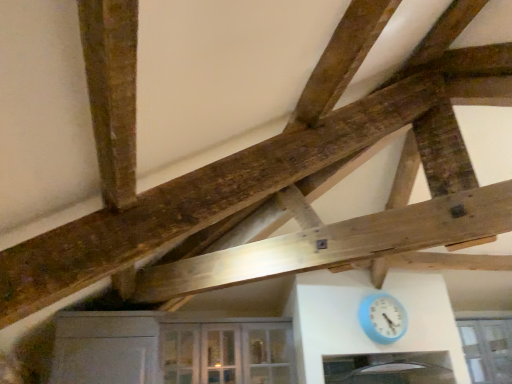
Question: Does clear glass window at lower right have a smaller size compared to clear glass cabinet at lower center?

Choices:
 (A) yes
 (B) no

Answer: (A)

Question: Is clear glass window at lower right aimed at clear glass cabinet at lower center?

Choices:
 (A) no
 (B) yes

Answer: (A)

Question: Is clear glass window at lower right at the left side of clear glass cabinet at lower center?

Choices:
 (A) yes
 (B) no

Answer: (B)

Question: Does clear glass window at lower right have a lesser width compared to clear glass cabinet at lower center?

Choices:
 (A) no
 (B) yes

Answer: (B)

Question: From the image's perspective, is clear glass window at lower right below clear glass cabinet at lower center?

Choices:
 (A) no
 (B) yes

Answer: (B)

Question: Considering the positions of blue plastic clock at lower right and clear glass window at lower right in the image, is blue plastic clock at lower right bigger or smaller than clear glass window at lower right?

Choices:
 (A) big
 (B) small

Answer: (B)

Question: Is blue plastic clock at lower right taller or shorter than clear glass window at lower right?

Choices:
 (A) short
 (B) tall

Answer: (A)

Question: From the image's perspective, relative to clear glass window at lower right, is blue plastic clock at lower right above or below?

Choices:
 (A) above
 (B) below

Answer: (A)

Question: In the image, is blue plastic clock at lower right on the left side or the right side of clear glass window at lower right?

Choices:
 (A) left
 (B) right

Answer: (A)

Question: Based on their sizes in the image, would you say clear glass cabinet at lower center is bigger or smaller than blue plastic clock at lower right?

Choices:
 (A) big
 (B) small

Answer: (A)

Question: In terms of width, does clear glass cabinet at lower center look wider or thinner when compared to blue plastic clock at lower right?

Choices:
 (A) wide
 (B) thin

Answer: (A)

Question: From a real-world perspective, is clear glass cabinet at lower center physically located above or below blue plastic clock at lower right?

Choices:
 (A) above
 (B) below

Answer: (B)

Question: From the image's perspective, is clear glass cabinet at lower center above or below blue plastic clock at lower right?

Choices:
 (A) below
 (B) above

Answer: (A)

Question: Is clear glass cabinet at lower center situated inside clear glass window at lower right or outside?

Choices:
 (A) outside
 (B) inside

Answer: (A)

Question: Is point (259, 347) closer or farther from the camera than point (501, 375)?

Choices:
 (A) closer
 (B) farther

Answer: (A)